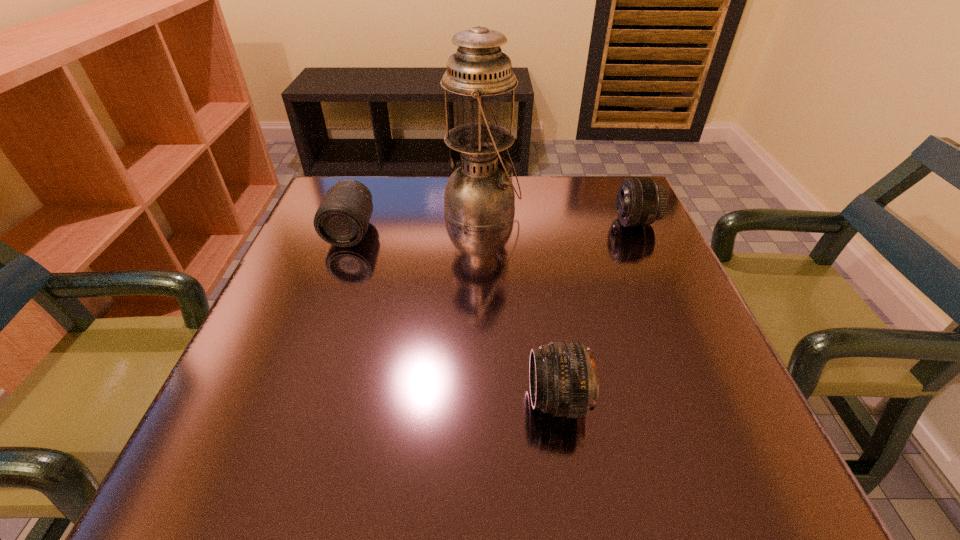
The width and height of the screenshot is (960, 540). In the image, there is a desktop. What are the coordinates of `vacant space at the near edge` in the screenshot? It's located at (542, 446).

The image size is (960, 540). I want to click on free location at the left edge of the desktop, so click(x=267, y=354).

This screenshot has height=540, width=960. I want to click on vacant point at the right edge, so click(609, 286).

You are a GUI agent. You are given a task and a screenshot of the screen. Output one action in this format:
    pyautogui.click(x=<x>, y=<y>)
    Task: Click on the vacant space at the far right corner
    
    Given the screenshot: What is the action you would take?
    pyautogui.click(x=579, y=179)

The width and height of the screenshot is (960, 540). In order to click on free spot between the second telephoto lens from left to right and the oil lamp in this screenshot , I will do `click(520, 305)`.

This screenshot has width=960, height=540. I want to click on unoccupied position between the nearest object and the rightmost object, so click(596, 311).

Where is `blank region between the oil lamp and the nearest telephoto lens`? This screenshot has height=540, width=960. blank region between the oil lamp and the nearest telephoto lens is located at coordinates (520, 305).

The height and width of the screenshot is (540, 960). Find the location of `vacant point located between the oil lamp and the rightmost telephoto lens`. vacant point located between the oil lamp and the rightmost telephoto lens is located at coordinates (559, 217).

Where is `unoccupied area between the leftmost object and the second telephoto lens from right to left`? The image size is (960, 540). unoccupied area between the leftmost object and the second telephoto lens from right to left is located at coordinates (454, 315).

Locate an element on the screen. empty location between the leftmost telephoto lens and the nearest object is located at coordinates (454, 315).